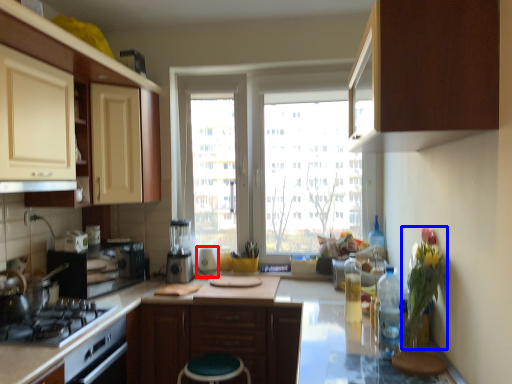
Question: Which object appears closest to the camera in this image, appliance (highlighted by a red box) or flower (highlighted by a blue box)?

Choices:
 (A) appliance
 (B) flower

Answer: (B)